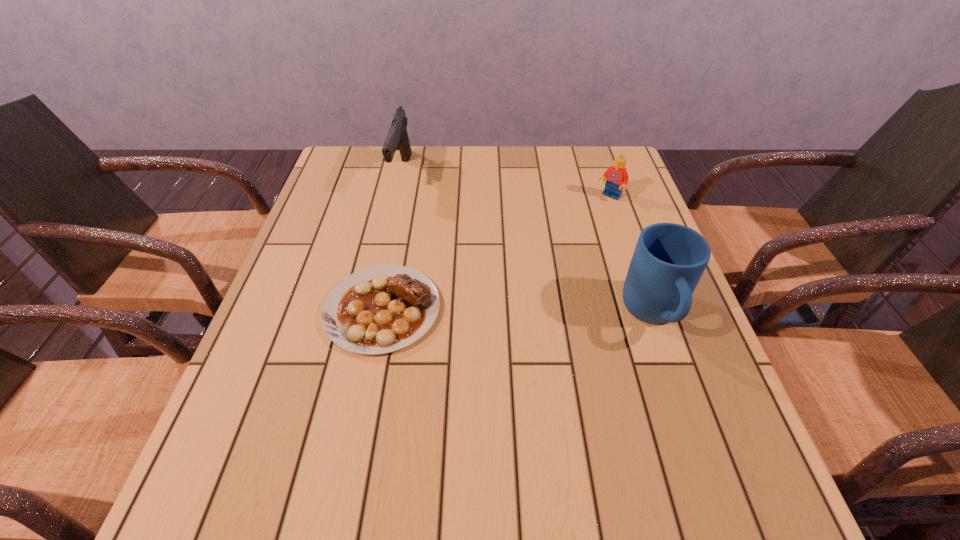
This screenshot has height=540, width=960. Find the location of `vacant space on the desktop that is between the shortest object and the mug and is positioned on the face of the Lego`. vacant space on the desktop that is between the shortest object and the mug and is positioned on the face of the Lego is located at coordinates (496, 312).

At what (x,y) coordinates should I click in order to perform the action: click on free space on the desktop that is between the shortest object and the mug and is positioned at the muzzle of the gun. Please return your answer as a coordinate pair (x, y). The height and width of the screenshot is (540, 960). Looking at the image, I should click on (541, 312).